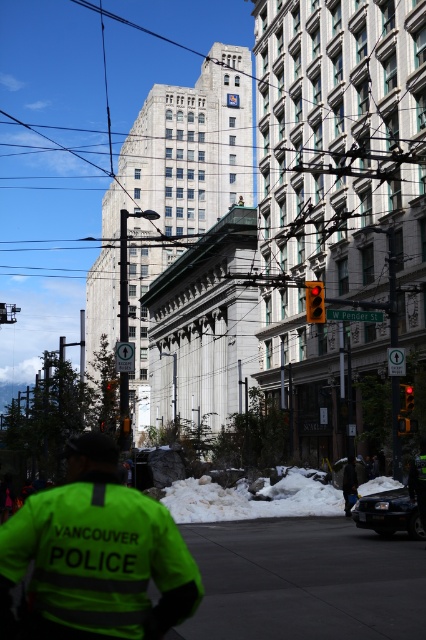
Question: Does neon yellow reflective vest at center have a lesser width compared to neon yellow reflective jacket at lower center?

Choices:
 (A) yes
 (B) no

Answer: (B)

Question: Which point is farther to the camera?

Choices:
 (A) neon yellow reflective jacket at lower center
 (B) neon yellow reflective vest at center

Answer: (A)

Question: Is neon yellow reflective vest at center above neon yellow reflective jacket at lower center?

Choices:
 (A) yes
 (B) no

Answer: (A)

Question: Can you confirm if neon yellow reflective vest at center is bigger than neon yellow reflective jacket at lower center?

Choices:
 (A) no
 (B) yes

Answer: (B)

Question: Which of the following is the farthest from the observer?

Choices:
 (A) (345, 497)
 (B) (135, 497)

Answer: (A)

Question: Which of the following is the closest to the observer?

Choices:
 (A) (356, 490)
 (B) (195, 570)

Answer: (B)